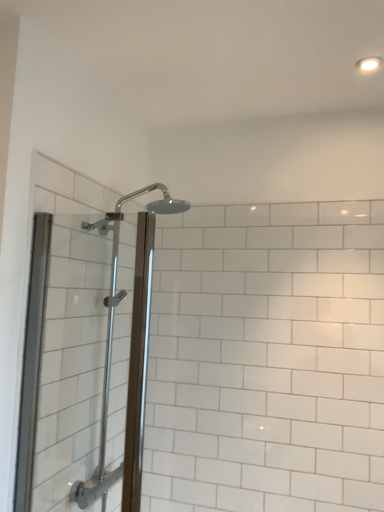
Question: Considering their positions, is polished chrome shower head at upper center located in front of or behind white glossy light fixture at upper right?

Choices:
 (A) behind
 (B) front

Answer: (B)

Question: Based on their sizes in the image, would you say polished chrome shower head at upper center is bigger or smaller than white glossy light fixture at upper right?

Choices:
 (A) big
 (B) small

Answer: (A)

Question: Considering the real-world distances, which object is farthest from the clear glass shower door at left?

Choices:
 (A) polished chrome shower head at upper center
 (B) white glossy light fixture at upper right

Answer: (B)

Question: Which is farther from the clear glass shower door at left?

Choices:
 (A) polished chrome shower head at upper center
 (B) white glossy light fixture at upper right

Answer: (B)